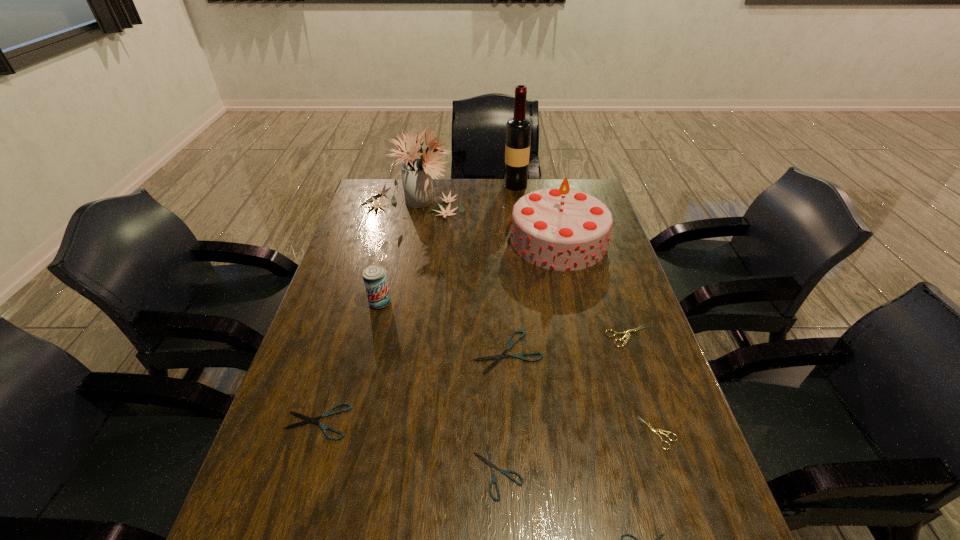
Locate an element on the screen. Image resolution: width=960 pixels, height=540 pixels. the tallest object is located at coordinates (518, 129).

Where is `the ninth shortest object`? The width and height of the screenshot is (960, 540). the ninth shortest object is located at coordinates (417, 173).

I want to click on white bouquet, so click(417, 173).

Locate an element on the screen. the third tallest object is located at coordinates (561, 229).

Locate an element on the screen. The width and height of the screenshot is (960, 540). beer can is located at coordinates (375, 280).

I want to click on the seventh shortest object, so click(x=375, y=280).

Locate an element on the screen. The image size is (960, 540). the farthest black shears is located at coordinates pos(510,344).

Where is `the farther beige shears`? the farther beige shears is located at coordinates (627, 333).

Where is `the leftmost shears`? This screenshot has height=540, width=960. the leftmost shears is located at coordinates (308, 419).

The height and width of the screenshot is (540, 960). I want to click on the third nearest black shears, so click(x=308, y=419).